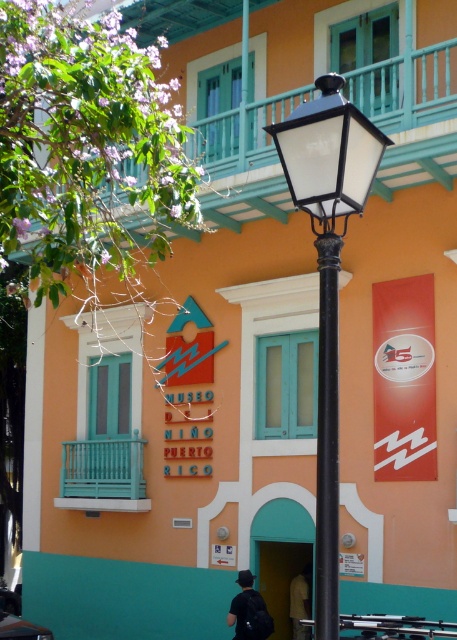
How much distance is there between black matte street light at center and dark gray fabric shirt at lower center?

They are 34.48 feet apart.

The width and height of the screenshot is (457, 640). What do you see at coordinates (328, 280) in the screenshot? I see `black matte street light at center` at bounding box center [328, 280].

The width and height of the screenshot is (457, 640). Find the location of `black matte street light at center`. black matte street light at center is located at coordinates (328, 280).

The width and height of the screenshot is (457, 640). What are the coordinates of `black matte street light at center` in the screenshot? It's located at (328, 280).

Is black metal pole at center to the right of dark gray fabric shirt at lower center from the viewer's perspective?

No, black metal pole at center is not to the right of dark gray fabric shirt at lower center.

What do you see at coordinates (327, 436) in the screenshot? Image resolution: width=457 pixels, height=640 pixels. I see `black metal pole at center` at bounding box center [327, 436].

Find the location of a particular element. This screenshot has width=457, height=640. black metal pole at center is located at coordinates (327, 436).

Is black matte street light at center to the right of black metal pole at center from the viewer's perspective?

Incorrect, black matte street light at center is not on the right side of black metal pole at center.

Is black matte street light at center bigger than black metal pole at center?

Yes, black matte street light at center is bigger than black metal pole at center.

Measure the distance between black matte street light at center and camera.

The distance of black matte street light at center from camera is 14.81 feet.

This screenshot has height=640, width=457. Identify the location of black matte street light at center. (328, 280).